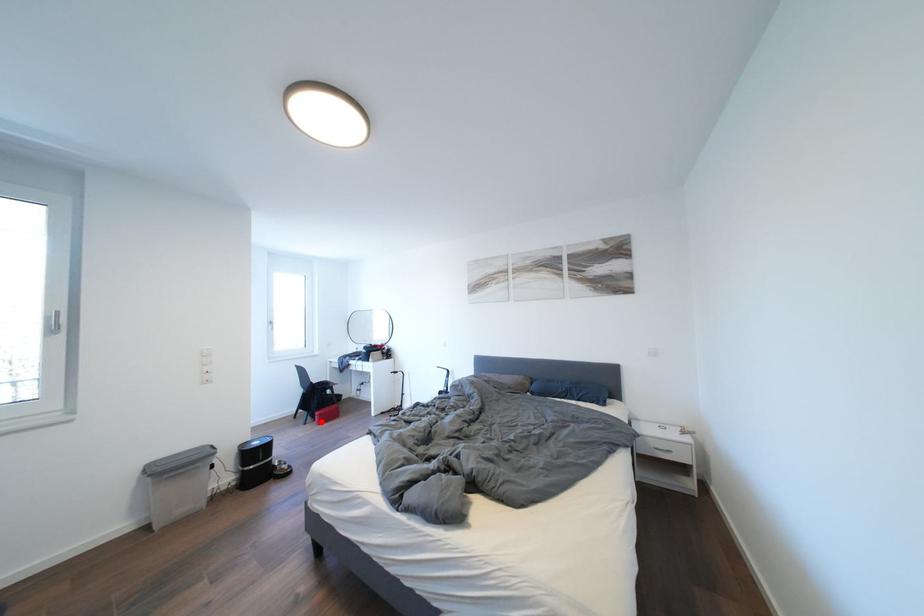
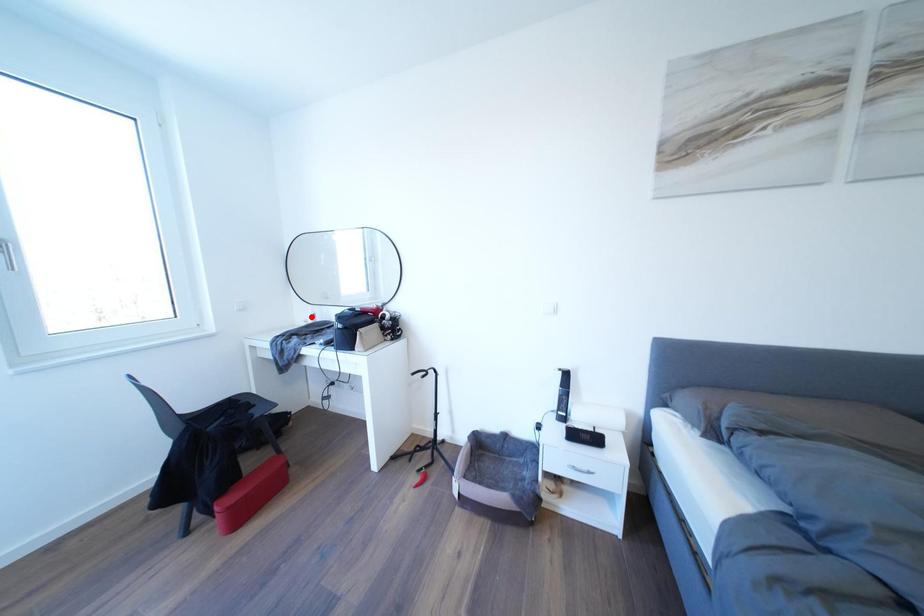
I am providing you with two images of the same scene from different viewpoints. A red point is marked on the first image and another point is marked on the second image. Are the points marked in image1 and image2 representing the same 3D position?

No